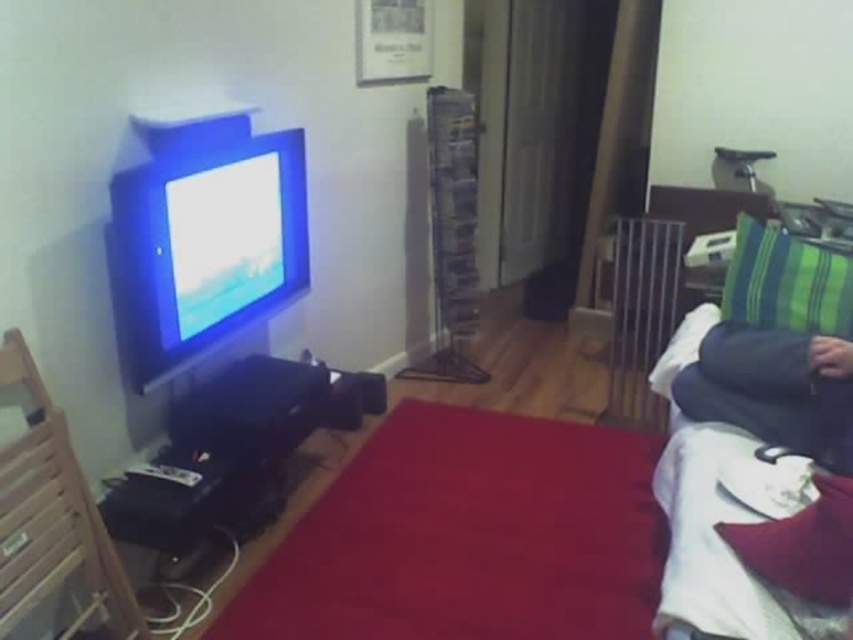
Question: Is wooden armchair at left above velvet red pillow at lower right?

Choices:
 (A) yes
 (B) no

Answer: (B)

Question: Which object is the farthest from the dark blue fabric at right?

Choices:
 (A) green striped pillow at right
 (B) wooden armchair at left

Answer: (B)

Question: Does dark blue fabric at right have a larger size compared to green striped pillow at right?

Choices:
 (A) no
 (B) yes

Answer: (A)

Question: Which point is farther to the camera?

Choices:
 (A) (706, 349)
 (B) (751, 253)
 (C) (38, 451)

Answer: (B)

Question: Among these points, which one is farthest from the camera?

Choices:
 (A) (51, 403)
 (B) (843, 484)
 (C) (776, 368)
 (D) (734, 289)

Answer: (D)

Question: Does wooden armchair at left lie in front of velvet red pillow at lower right?

Choices:
 (A) yes
 (B) no

Answer: (B)